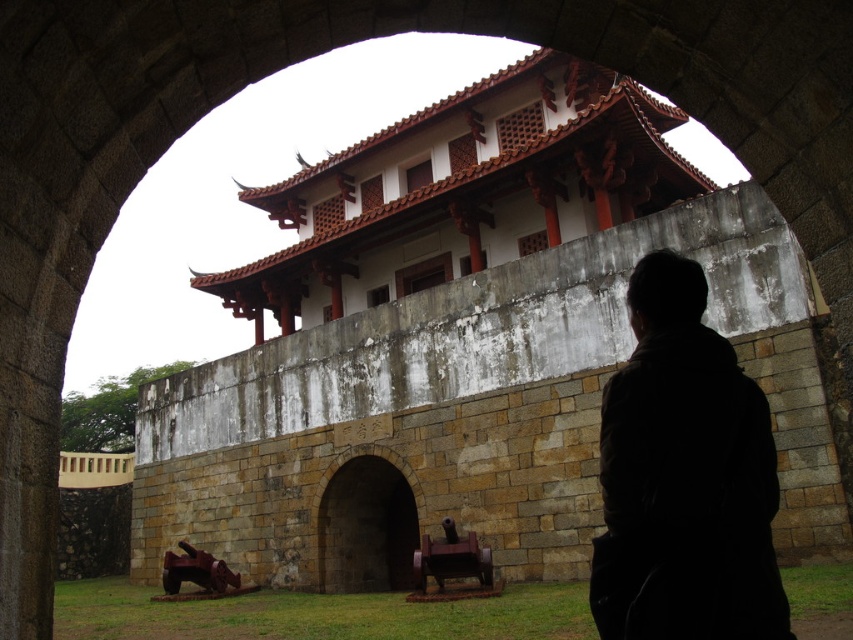
In the scene shown: You are a tour guide standing at the entrance of the historical site. You notice a visitor is trying to take a photo of both the black matte coat at lower right and the brown stone archway at center in the same frame. Based on their current position, can they fit both objects into the photo without moving? Explain your reasoning using the spatial information provided.

The black matte coat at lower right and the brown stone archway at center are 24.23 meters apart. Since the distance between them is quite large, the visitor would need to step back sufficiently to capture both in the same frame. However, without knowing the camera sensor size or lens focal length, it is difficult to definitively confirm if they can fit both objects into the photo without moving. Generally, at 24 meters apart, a wide angle lens or a camera with a large sensor might be required to capture a